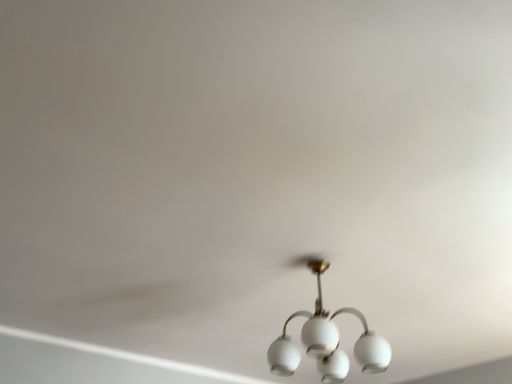
Image resolution: width=512 pixels, height=384 pixels. What do you see at coordinates (326, 339) in the screenshot?
I see `white matte chandelier at center` at bounding box center [326, 339].

In order to click on white matte chandelier at center in this screenshot , I will do `click(326, 339)`.

Locate an element on the screen. The image size is (512, 384). white matte chandelier at center is located at coordinates (326, 339).